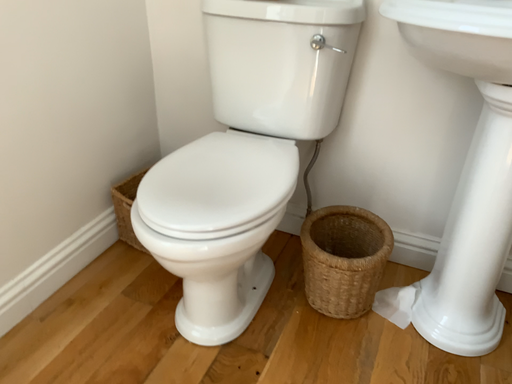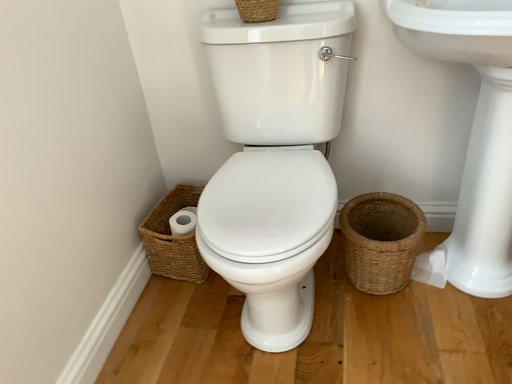
Question: Which way did the camera rotate in the video?

Choices:
 (A) rotated right
 (B) rotated left

Answer: (A)